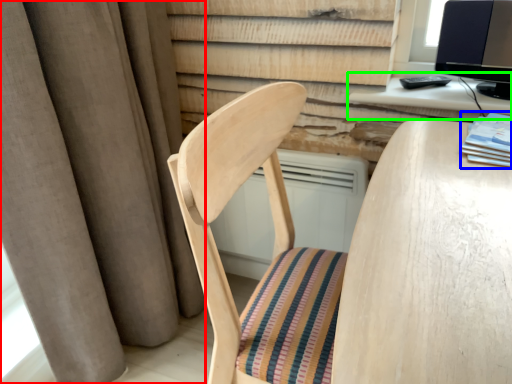
Question: Considering the real-world distances, which object is farthest from curtain (highlighted by a red box)? book (highlighted by a blue box) or computer desk (highlighted by a green box)?

Choices:
 (A) book
 (B) computer desk

Answer: (A)